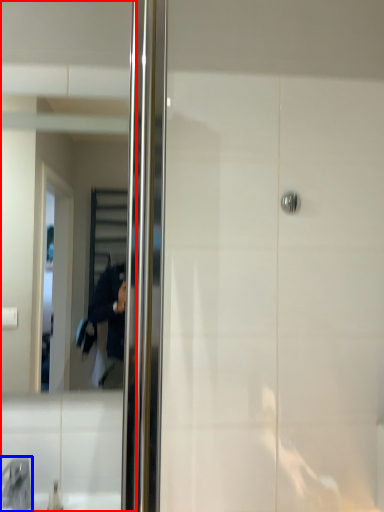
Question: Which object is closer to the camera taking this photo, mirror (highlighted by a red box) or faucet (highlighted by a blue box)?

Choices:
 (A) mirror
 (B) faucet

Answer: (B)